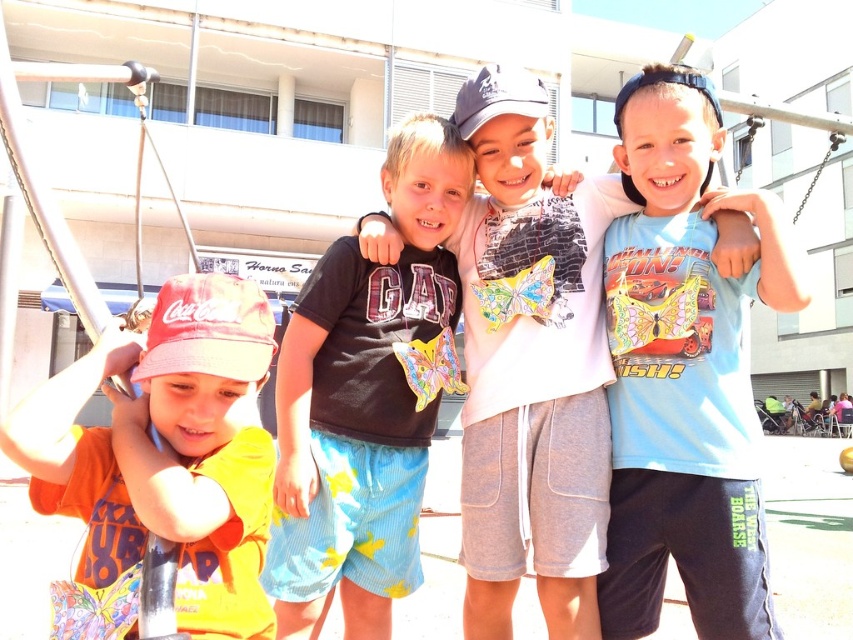
How far apart are light blue cotton shirt at center and orange cotton shirt at left?

1.27 meters

Who is lower down, light blue cotton shirt at center or orange cotton shirt at left?

orange cotton shirt at left is lower down.

Measure the distance between point (579, 323) and camera.

Point (579, 323) is 2.65 meters away from camera.

At what (x,y) coordinates should I click in order to perform the action: click on light blue cotton shirt at center. Please return your answer as a coordinate pair (x, y). Image resolution: width=853 pixels, height=640 pixels. Looking at the image, I should click on (531, 364).

Does matte black t-shirt at center appear on the left side of orange cotton shirt at left?

No, matte black t-shirt at center is not to the left of orange cotton shirt at left.

In the scene shown: Measure the distance between point [427,300] and camera.

Point [427,300] and camera are 2.75 meters apart.

Measure the distance between point (321, 413) and camera.

Point (321, 413) is 8.41 feet away from camera.

Image resolution: width=853 pixels, height=640 pixels. I want to click on matte black t-shirt at center, so click(363, 401).

Does light blue cotton shirt at center have a greater height compared to matte black t-shirt at center?

Correct, light blue cotton shirt at center is much taller as matte black t-shirt at center.

The width and height of the screenshot is (853, 640). Identify the location of light blue cotton shirt at center. (531, 364).

Does point (521, 513) lie behind point (317, 564)?

Yes, point (521, 513) is behind point (317, 564).

I want to click on light blue cotton shirt at center, so coord(531,364).